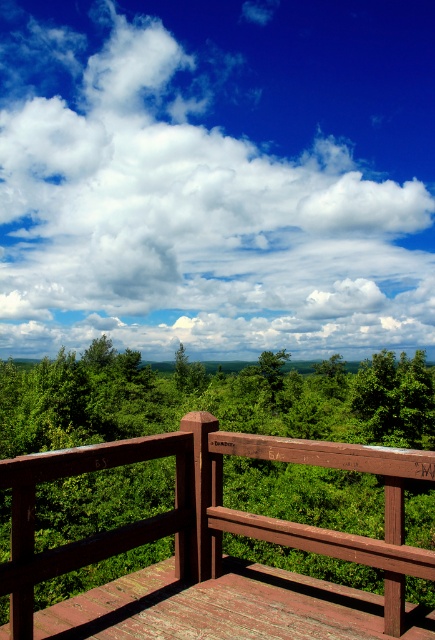
You are standing on the wooden deck and looking at the white fluffy cloud at upper center and the brown wooden rail at center. Which object is higher from the ground?

The white fluffy cloud at upper center is much taller than the brown wooden rail at center, so it is higher from the ground.

You are standing on the wooden deck and want to know if you can see the white fluffy cloud at upper center from behind the brown wooden rail at center. Based on their distance apart, can you see it?

The white fluffy cloud at upper center and brown wooden rail at center are 141.29 meters apart. Since the distance is significant, you can see the white fluffy cloud at upper center from behind the brown wooden rail at center as there is enough space between them.

You are standing on the wooden deck and looking at two points marked on the railing. The first point is at coordinates point (70,276) and the second point is at point (22,621). Which point is closer to your eyes?

Point (22,621) is closer to your eyes because it is less further to the camera than point (70,276).